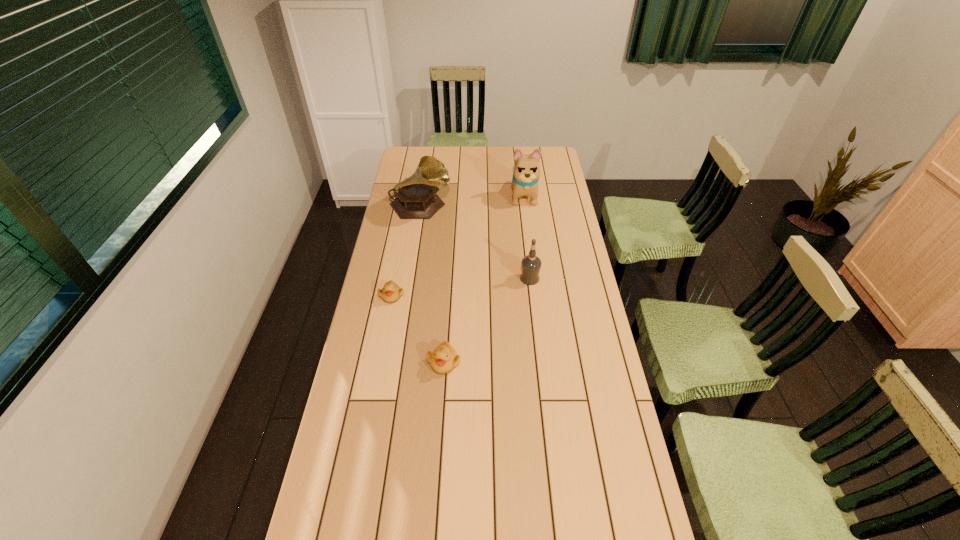
Find the location of a particular element. free space that satisfies the following two spatial constraints: 1. on the face of the puppy; 2. on the horn direction of the phonograph record is located at coordinates (525, 207).